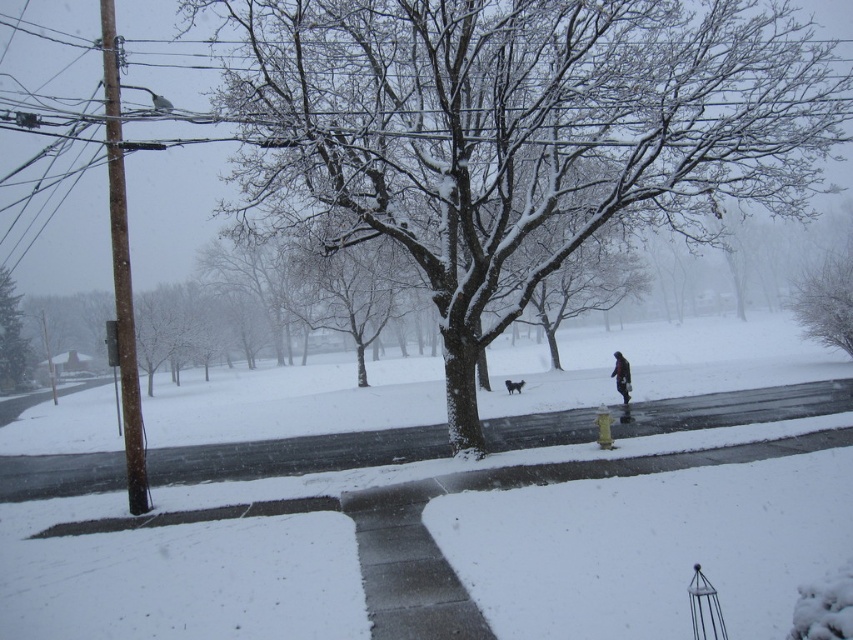
You are a delivery person trying to navigate through the snow. You see a frosted white tree at upper right and a dark gray coat at center. Which object is higher up in the image?

The frosted white tree at upper right is located above the dark gray coat at center, so it is higher up in the image.